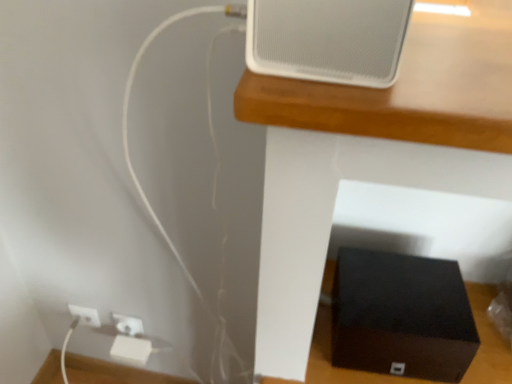
I want to click on free point above black matte box at lower right (from a real-world perspective), so click(x=403, y=293).